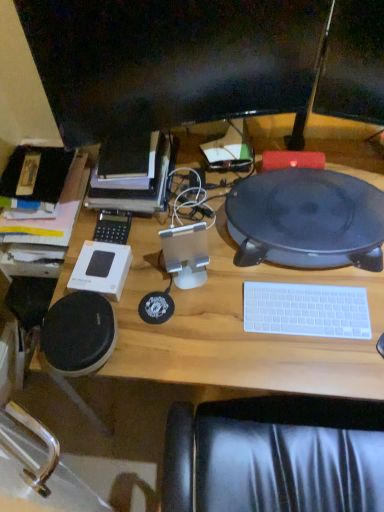
Locate an element on the screen. free spot below white plastic keyboard at lower right (from a real-world perspective) is located at coordinates (304, 313).